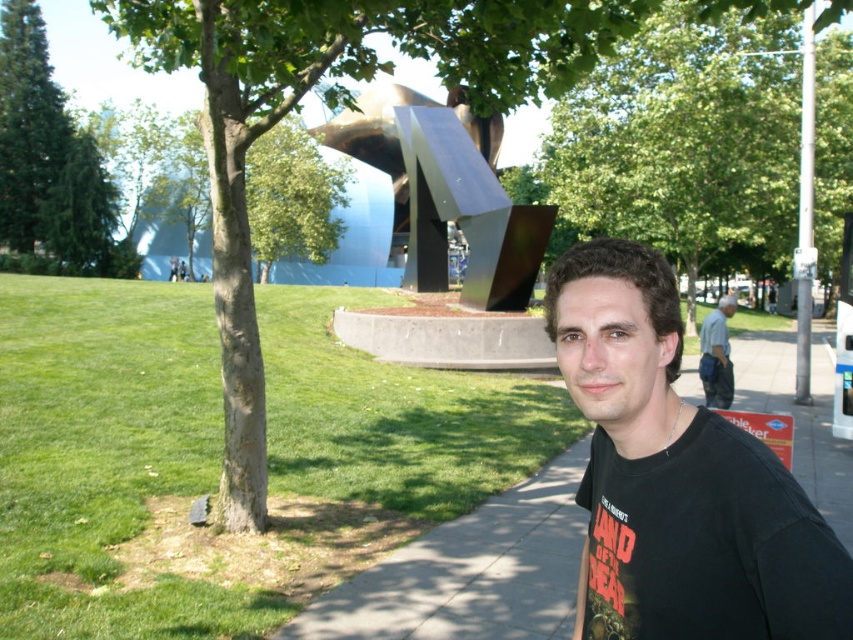
Is metallic silver sculpture at center to the left of gray fabric bag at lower right from the viewer's perspective?

Yes, metallic silver sculpture at center is to the left of gray fabric bag at lower right.

Which is above, metallic silver sculpture at center or gray fabric bag at lower right?

Positioned higher is metallic silver sculpture at center.

Between point (440, 180) and point (706, 339), which one is positioned in front?

Positioned in front is point (706, 339).

The height and width of the screenshot is (640, 853). I want to click on metallic silver sculpture at center, so click(x=445, y=193).

Does green leafy tree at upper center appear on the left side of gray concrete sidewalk at lower center?

No, green leafy tree at upper center is not to the left of gray concrete sidewalk at lower center.

What are the coordinates of `green leafy tree at upper center` in the screenshot? It's located at (682, 144).

The image size is (853, 640). I want to click on green leafy tree at upper center, so click(x=682, y=144).

Who is more forward, (709, 468) or (740, 118)?

Positioned in front is point (709, 468).

Describe the element at coordinates (677, 477) in the screenshot. I see `black matte shirt at center` at that location.

Between point (749, 508) and point (747, 76), which one is positioned in front?

Positioned in front is point (749, 508).

Identify the location of black matte shirt at center. (677, 477).